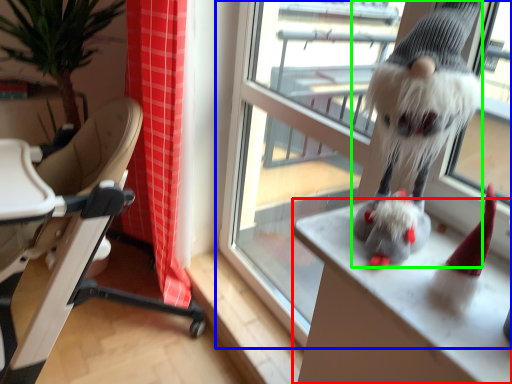
Question: Considering the real-world distances, which object is farthest from desk (highlighted by a red box)? window (highlighted by a blue box) or animal (highlighted by a green box)?

Choices:
 (A) window
 (B) animal

Answer: (A)